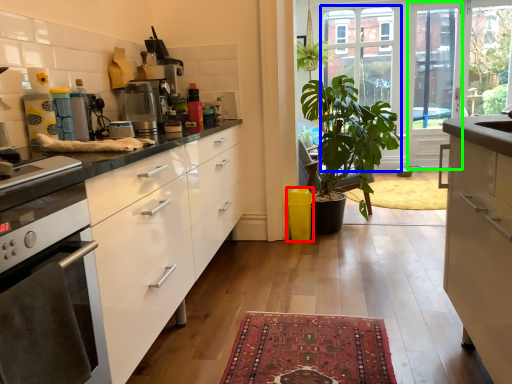
Question: Which is nearer to the trash bin/can (highlighted by a red box)? glass door (highlighted by a blue box) or screen door (highlighted by a green box).

Choices:
 (A) glass door
 (B) screen door

Answer: (A)